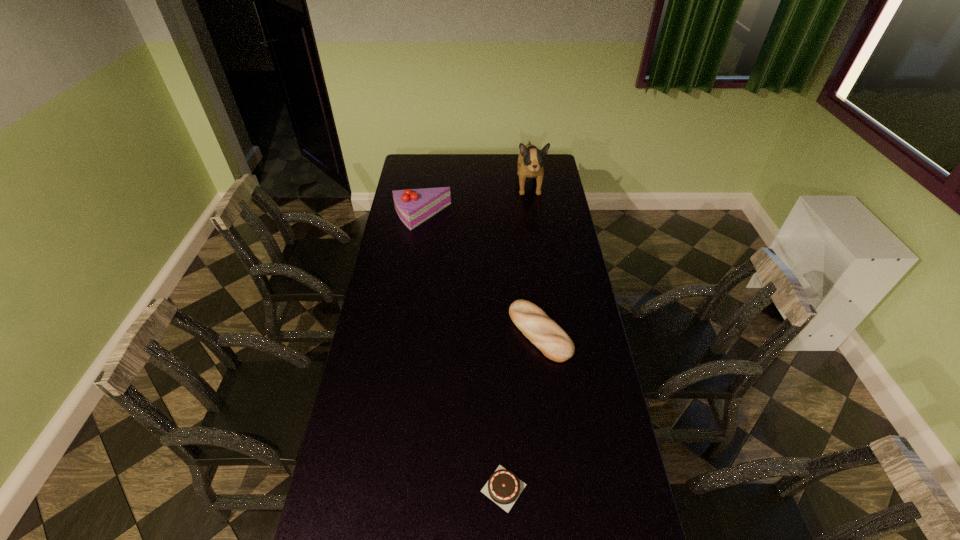
Locate an element on the screen. free point at the far left corner is located at coordinates (407, 165).

Where is `free space between the bread and the tallest object`? The height and width of the screenshot is (540, 960). free space between the bread and the tallest object is located at coordinates (535, 259).

The width and height of the screenshot is (960, 540). Find the location of `free space between the farthest object and the shortest object`. free space between the farthest object and the shortest object is located at coordinates (516, 336).

Image resolution: width=960 pixels, height=540 pixels. In order to click on free space between the nearest object and the tallest object in this screenshot , I will do `click(516, 336)`.

Locate an element on the screen. vacant region between the bread and the cake is located at coordinates (481, 274).

Where is `vacant area that lies between the cake and the second shortest object`? vacant area that lies between the cake and the second shortest object is located at coordinates (481, 274).

The image size is (960, 540). What are the coordinates of `free spot between the bread and the cake` in the screenshot? It's located at click(x=481, y=274).

I want to click on free space that is in between the farthest object and the chocolate cake, so pyautogui.click(x=516, y=336).

At what (x,y) coordinates should I click in order to perform the action: click on unoccupied area between the chocolate cake and the leftmost object. Please return your answer as a coordinate pair (x, y). Image resolution: width=960 pixels, height=540 pixels. Looking at the image, I should click on (463, 353).

Where is `free spot between the second nearest object and the second tallest object`? The width and height of the screenshot is (960, 540). free spot between the second nearest object and the second tallest object is located at coordinates click(481, 274).